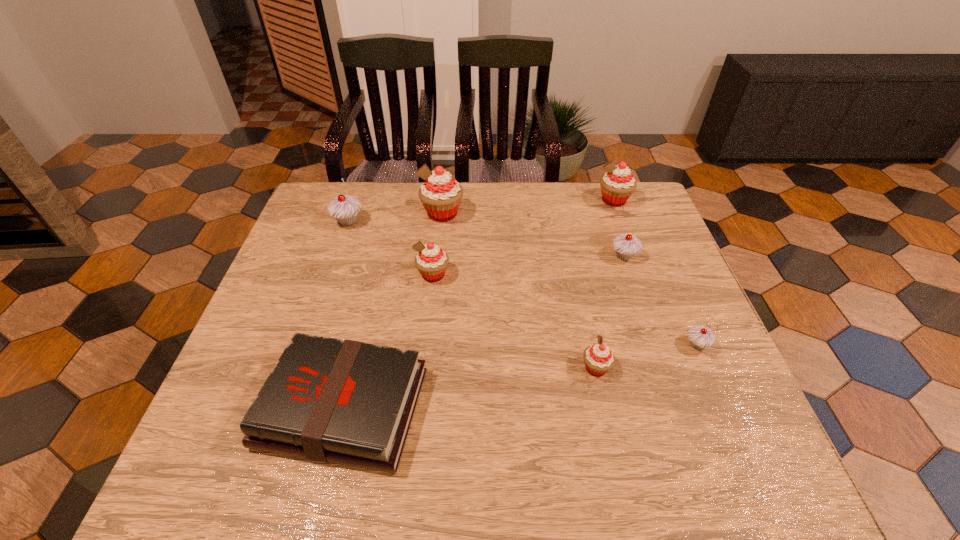
Locate an element on the screen. Image resolution: width=960 pixels, height=540 pixels. vacant space at the far right corner is located at coordinates (608, 221).

Image resolution: width=960 pixels, height=540 pixels. Find the location of `free space between the leftmost cupcake and the red hardback book`. free space between the leftmost cupcake and the red hardback book is located at coordinates (346, 314).

Identify the location of empty space that is in between the third farthest pink cupcake and the second pink cupcake from right to left. (515, 321).

Locate an element on the screen. Image resolution: width=960 pixels, height=540 pixels. vacant area that lies between the second gray cupcake from right to left and the fourth cupcake from left to right is located at coordinates (610, 312).

Find the location of a particular element. The image size is (960, 540). free spot between the biggest gray cupcake and the second biggest gray cupcake is located at coordinates (486, 239).

What are the coordinates of `free space between the second biggest pink cupcake and the hardback book` in the screenshot? It's located at (478, 304).

In order to click on blank region between the rightmost pink cupcake and the second pink cupcake from right to left in this screenshot , I will do `click(605, 284)`.

This screenshot has height=540, width=960. Find the location of `blank region between the biggest gray cupcake and the fourth object from right to left`. blank region between the biggest gray cupcake and the fourth object from right to left is located at coordinates (471, 295).

Where is `free area in between the biggest pink cupcake and the second smallest pink cupcake`? The height and width of the screenshot is (540, 960). free area in between the biggest pink cupcake and the second smallest pink cupcake is located at coordinates (438, 244).

Locate an element on the screen. free spot between the third smallest pink cupcake and the second smallest gray cupcake is located at coordinates (618, 228).